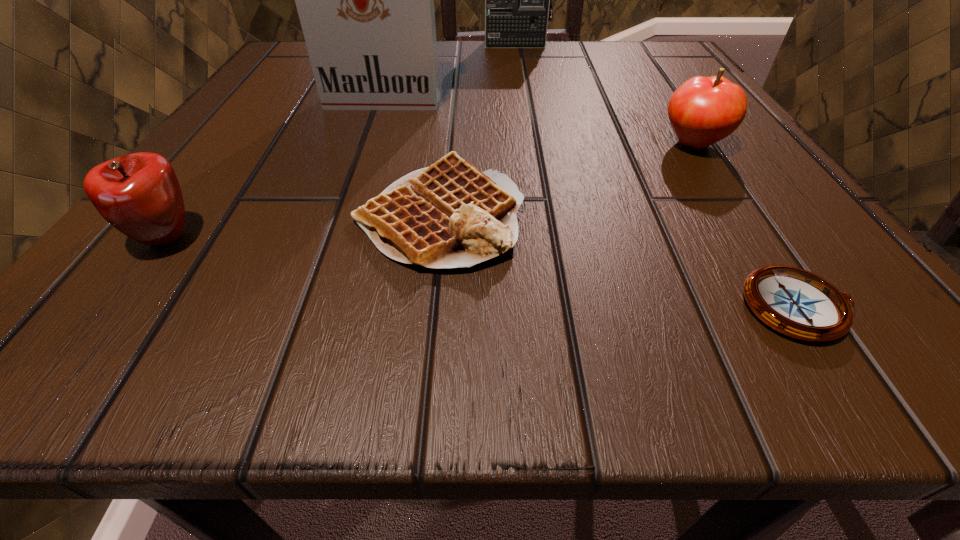
Identify the location of compass located in the right edge section of the desktop. tap(795, 302).

Where is `object that is at the far left corner`? object that is at the far left corner is located at coordinates (365, 0).

Find the location of a particular element. object that is at the near right corner is located at coordinates (795, 302).

The width and height of the screenshot is (960, 540). In order to click on vacant space at the near edge of the desktop in this screenshot , I will do `click(570, 304)`.

You are a GUI agent. You are given a task and a screenshot of the screen. Output one action in this format:
    pyautogui.click(x=<x>, y=<y>)
    Task: Click on the vacant space at the left edge of the desktop
    
    Given the screenshot: What is the action you would take?
    pyautogui.click(x=204, y=151)

This screenshot has width=960, height=540. In order to click on free space at the right edge of the desktop in this screenshot , I will do `click(708, 171)`.

I want to click on vacant space at the far left corner of the desktop, so click(x=300, y=72).

The height and width of the screenshot is (540, 960). In order to click on free spot at the far right corner of the desktop in this screenshot , I will do `click(588, 42)`.

Where is `vacant region at the near right corner of the desktop`? The height and width of the screenshot is (540, 960). vacant region at the near right corner of the desktop is located at coordinates (735, 339).

The height and width of the screenshot is (540, 960). What are the coordinates of `blank region between the shortest object and the cigarette case` in the screenshot? It's located at (592, 203).